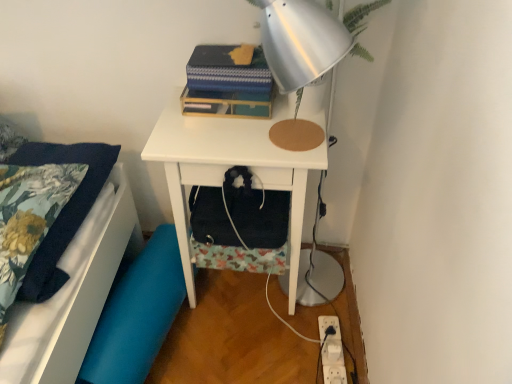
At what (x,y) coordinates should I click in order to perform the action: click on empty space that is to the right of blue fabric swivel chair at lower left. Please return your answer as a coordinate pair (x, y). The height and width of the screenshot is (384, 512). Looking at the image, I should click on (239, 326).